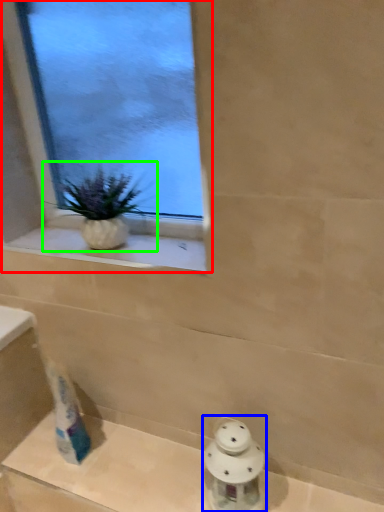
Question: Which object is positioned farthest from window (highlighted by a red box)? Select from porcelain (highlighted by a blue box) and houseplant (highlighted by a green box).

Choices:
 (A) porcelain
 (B) houseplant

Answer: (A)